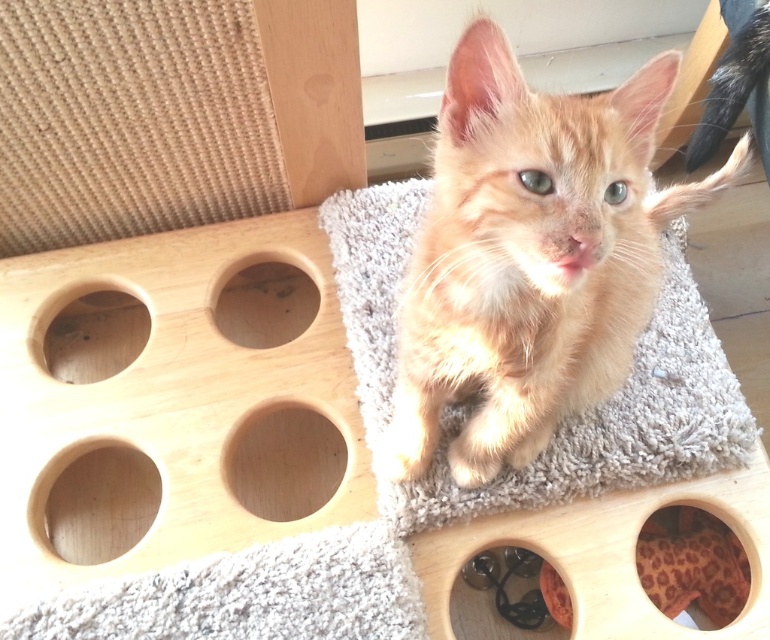
Question: Estimate the real-world distances between objects in this image. Which object is farther from the orange fur cat at center?

Choices:
 (A) leopard print fabric at lower right
 (B) wooden hole at center

Answer: (B)

Question: From the image, what is the correct spatial relationship of smooth wood hole at lower left in relation to black rubber hole at lower center?

Choices:
 (A) below
 (B) above

Answer: (B)

Question: Does orange fur cat at center have a lesser width compared to smooth light brown wooden hole at center left?

Choices:
 (A) yes
 (B) no

Answer: (B)

Question: Which point appears farthest from the camera in this image?

Choices:
 (A) (39, 483)
 (B) (300, 464)
 (C) (638, 548)

Answer: (B)

Question: Is orange fur cat at center further to camera compared to smooth light brown wooden hole at center left?

Choices:
 (A) no
 (B) yes

Answer: (A)

Question: Which point is farther to the camera?

Choices:
 (A) smooth light brown wooden hole at center left
 (B) smooth wood hole at lower left

Answer: (B)